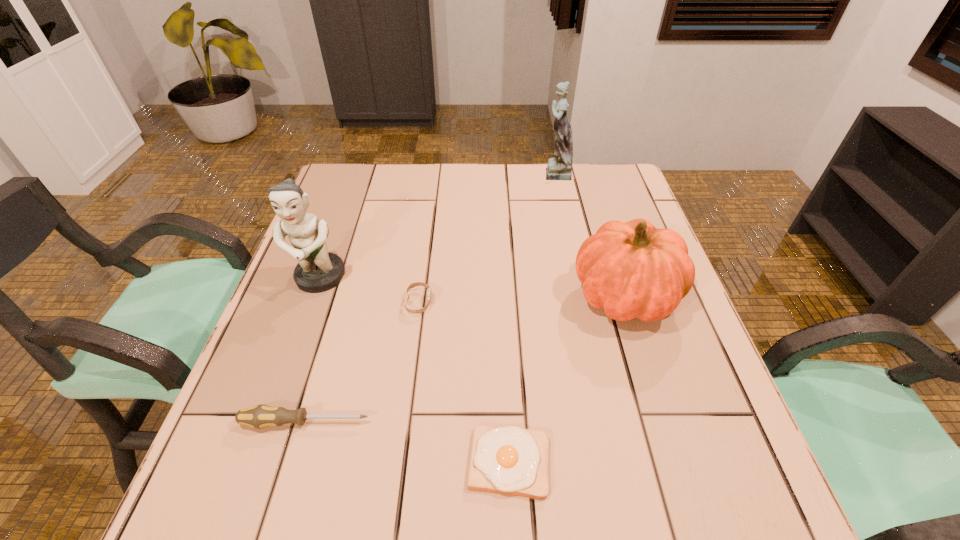
In order to click on the farthest object in this screenshot , I will do `click(560, 167)`.

Where is `the right figurine`? The width and height of the screenshot is (960, 540). the right figurine is located at coordinates pos(560,167).

This screenshot has width=960, height=540. Find the location of `the nearer figurine`. the nearer figurine is located at coordinates (318, 270).

The image size is (960, 540). In order to click on the third tallest object in this screenshot , I will do `click(632, 270)`.

Find the location of a particular element. This screenshot has height=540, width=960. screwdriver is located at coordinates (260, 416).

This screenshot has height=540, width=960. Find the location of `the fourth object from right to left`. the fourth object from right to left is located at coordinates (413, 285).

Where is `the shortest object`? The image size is (960, 540). the shortest object is located at coordinates (511, 460).

Identify the location of the third object from right to left. (511, 460).

This screenshot has height=540, width=960. I want to click on vacant space located 0.300m on the front-facing side of the farthest object, so coord(442,172).

At what (x,y) coordinates should I click in order to perform the action: click on vacant space located 0.130m on the front-facing side of the farthest object. Please return your answer as a coordinate pair (x, y). The height and width of the screenshot is (540, 960). Looking at the image, I should click on (495, 172).